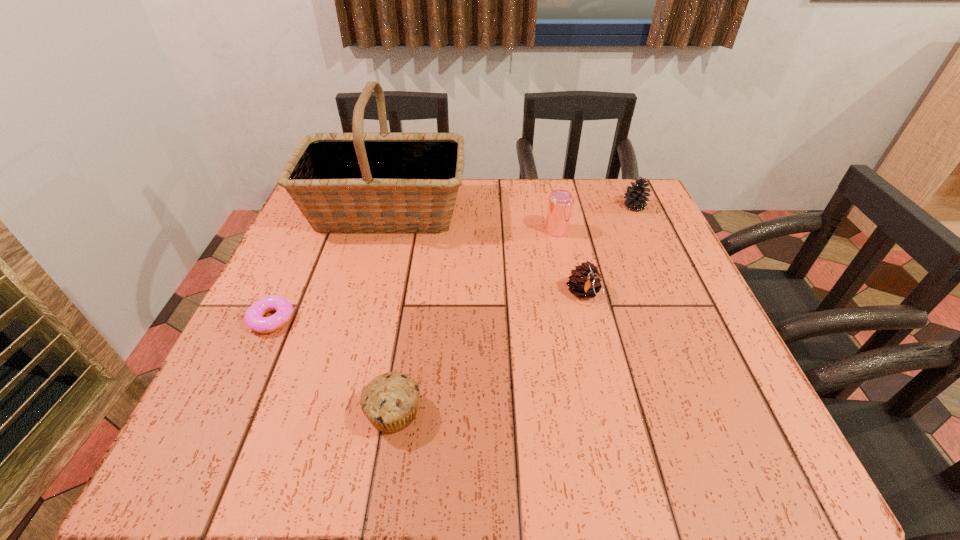
Locate an element on the screen. The image size is (960, 540). the tallest object is located at coordinates pos(343,183).

This screenshot has width=960, height=540. In order to click on beer can in this screenshot , I will do `click(560, 201)`.

At what (x,y) coordinates should I click in order to perform the action: click on the right pinecone. Please return your answer as a coordinate pair (x, y). Image resolution: width=960 pixels, height=540 pixels. Looking at the image, I should click on (635, 197).

The width and height of the screenshot is (960, 540). Identify the location of the farther pinecone. (635, 197).

Image resolution: width=960 pixels, height=540 pixels. I want to click on the nearer pinecone, so click(585, 280).

Where is `the nearest object`? The height and width of the screenshot is (540, 960). the nearest object is located at coordinates (390, 401).

Where is `the shortest object`? The height and width of the screenshot is (540, 960). the shortest object is located at coordinates (254, 319).

The height and width of the screenshot is (540, 960). I want to click on vacant region located by the handle of the tallest object, so click(508, 212).

At what (x,y) coordinates should I click in order to perform the action: click on free space located 0.250m on the front of the beer can. Please return your answer as a coordinate pair (x, y). This screenshot has height=540, width=960. Looking at the image, I should click on (574, 313).

This screenshot has width=960, height=540. Find the location of `vacant area situated on the back of the right pinecone`. vacant area situated on the back of the right pinecone is located at coordinates (623, 182).